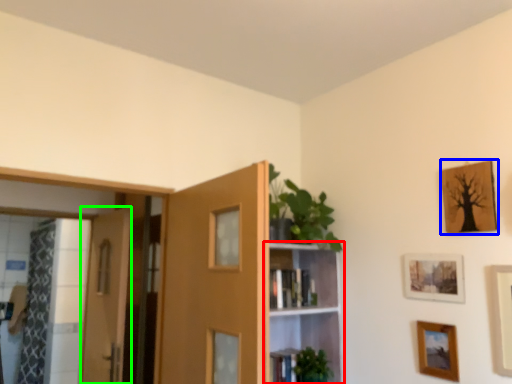
Question: Which is nearer to the shelf (highlighted by a red box)? picture frame (highlighted by a blue box) or door (highlighted by a green box).

Choices:
 (A) picture frame
 (B) door

Answer: (A)